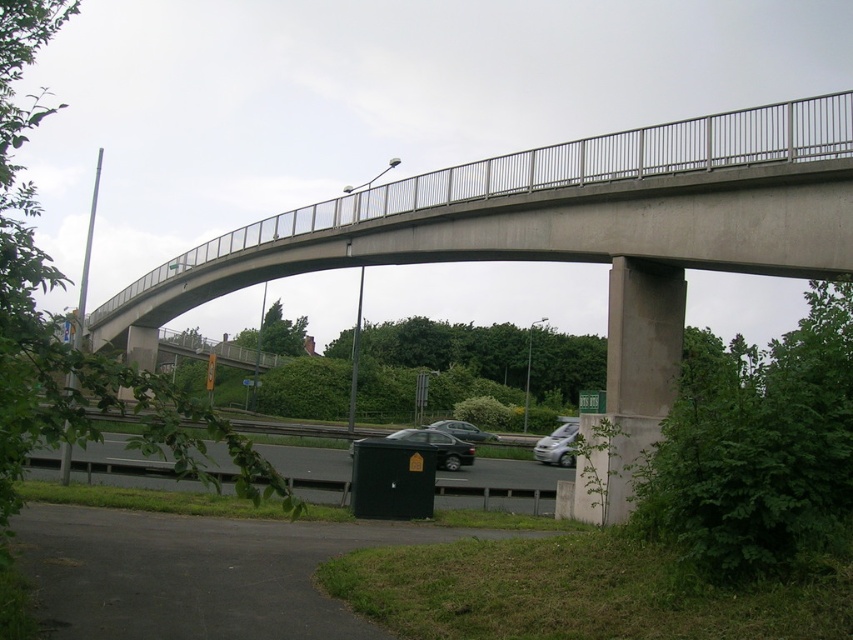
Question: Which of these objects is positioned closest to the green matte trash can at lower center?

Choices:
 (A) satin silver car at lower center
 (B) metallic gray sedan at center

Answer: (A)

Question: Which object is positioned farthest from the concrete bridge at center?

Choices:
 (A) green matte trash can at lower center
 (B) satin silver car at lower center
 (C) shiny black sedan at center

Answer: (B)

Question: Does concrete bridge at center have a greater width compared to green matte trash can at lower center?

Choices:
 (A) no
 (B) yes

Answer: (B)

Question: Which is farther from the satin silver car at lower center?

Choices:
 (A) shiny black sedan at center
 (B) concrete bridge at center

Answer: (B)

Question: Can you confirm if concrete bridge at center is positioned above shiny black sedan at center?

Choices:
 (A) yes
 (B) no

Answer: (A)

Question: Is concrete bridge at center above shiny black sedan at center?

Choices:
 (A) yes
 (B) no

Answer: (A)